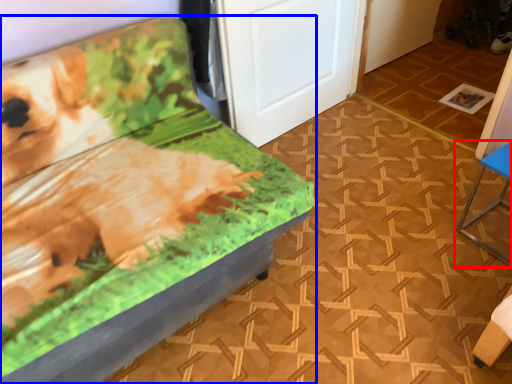
Question: Which object appears farthest to the camera in this image, furniture (highlighted by a red box) or furniture (highlighted by a blue box)?

Choices:
 (A) furniture
 (B) furniture

Answer: (A)